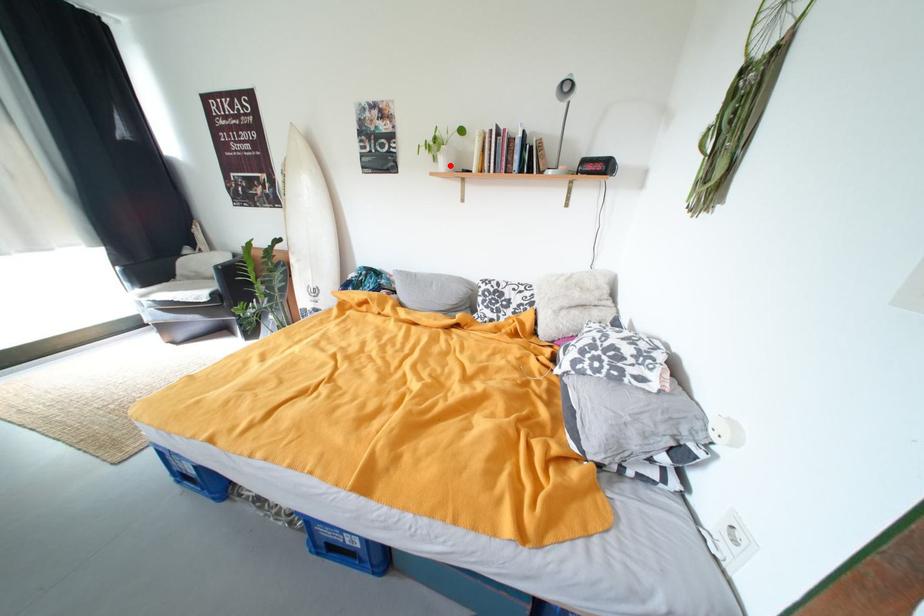
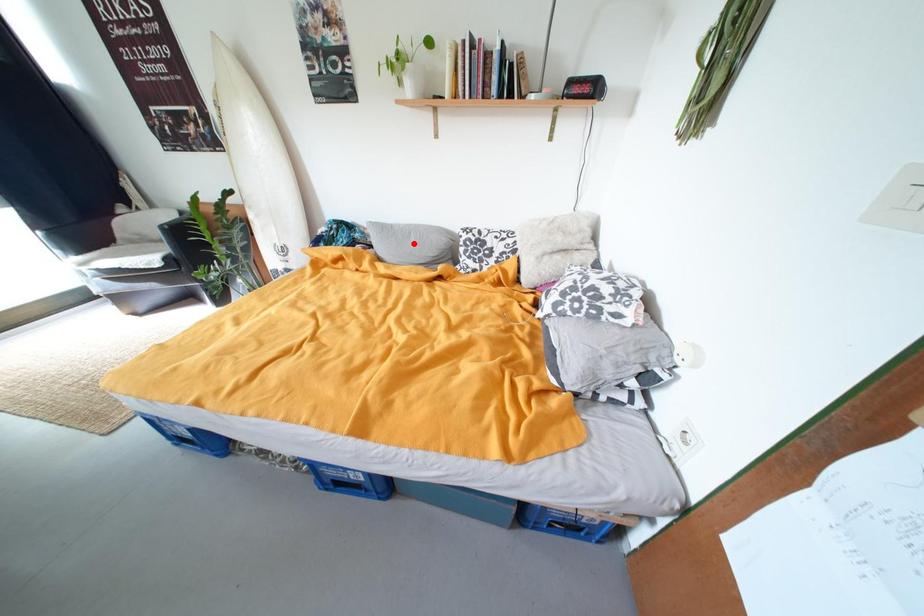
I am providing you with two images of the same scene from different viewpoints. A red point is marked on the first image and another point is marked on the second image. Do the highlighted points in image1 and image2 indicate the same real-world spot?

No